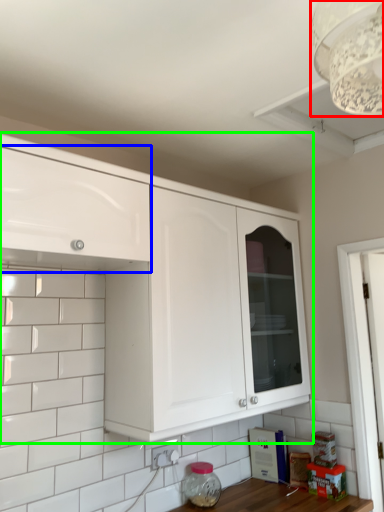
Question: Based on their relative distances, which object is nearer to light fixture (highlighted by a red box)? Choose from cabinetry (highlighted by a blue box) and cabinetry (highlighted by a green box).

Choices:
 (A) cabinetry
 (B) cabinetry

Answer: (A)